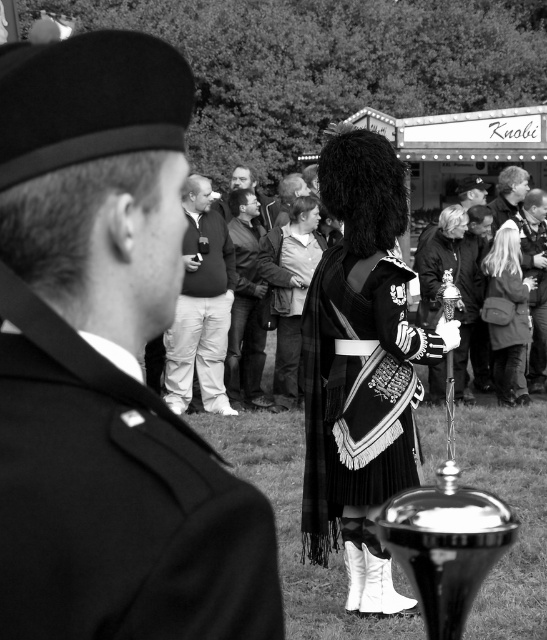
Which is behind, point (259, 289) or point (514, 326)?

Positioned behind is point (259, 289).

What do you see at coordinates (246, 305) in the screenshot?
I see `matte black dress at center` at bounding box center [246, 305].

I want to click on matte black dress at center, so click(246, 305).

From the picture: Is matte gray sweater at center wider than smooth leather jacket at center?

Correct, the width of matte gray sweater at center exceeds that of smooth leather jacket at center.

Between matte gray sweater at center and smooth leather jacket at center, which one is positioned higher?

smooth leather jacket at center is higher up.

Is point (177, 378) closer to viewer compared to point (241, 180)?

That is True.

I want to click on matte gray sweater at center, so click(200, 307).

Can you confirm if light gray sweater at center is shorter than matte black jacket at upper center?

Incorrect, light gray sweater at center's height does not fall short of matte black jacket at upper center's.

How much distance is there between light gray sweater at center and matte black jacket at upper center?

light gray sweater at center is 9.55 feet from matte black jacket at upper center.

Which is in front, point (292, 282) or point (484, 189)?

Point (292, 282)

Locate an element on the screen. The width and height of the screenshot is (547, 640). light gray sweater at center is located at coordinates (289, 291).